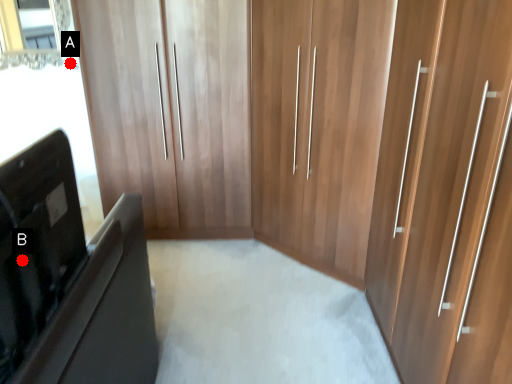
Question: Two points are circled on the image, labeled by A and B beside each circle. Which point is closer to the camera?

Choices:
 (A) A is closer
 (B) B is closer

Answer: (B)